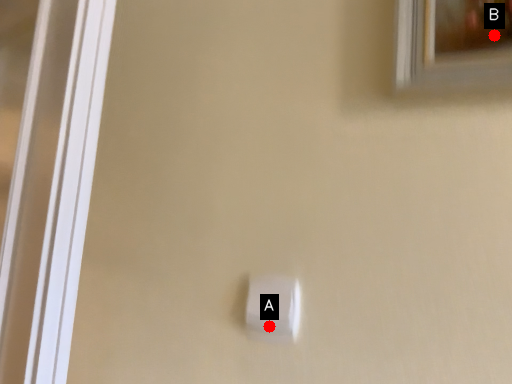
Question: Two points are circled on the image, labeled by A and B beside each circle. Among these points, which one is nearest to the camera?

Choices:
 (A) A is closer
 (B) B is closer

Answer: (B)